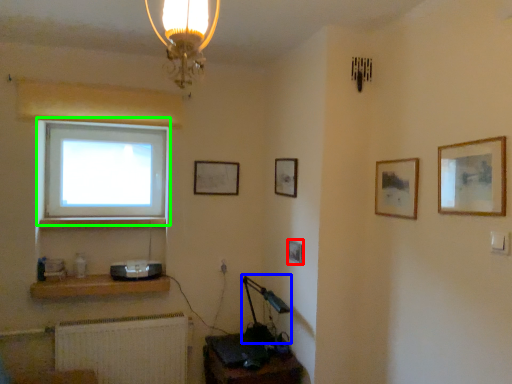
Question: Which object is the farthest from picture frame (highlighted by a red box)? Choose among these: table lamp (highlighted by a blue box) or window (highlighted by a green box).

Choices:
 (A) table lamp
 (B) window

Answer: (B)